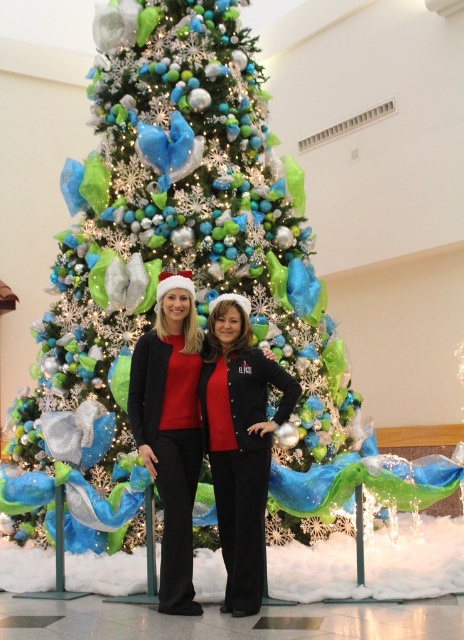
Question: Is shiny metallic christmas tree at center to the left of matte black pants at center from the viewer's perspective?

Choices:
 (A) yes
 (B) no

Answer: (A)

Question: Estimate the real-world distances between objects in this image. Which object is farther from the shiny metallic christmas tree at center?

Choices:
 (A) matte black pants at center
 (B) black matte jacket at center

Answer: (B)

Question: Can you confirm if shiny metallic christmas tree at center is positioned to the right of black matte jacket at center?

Choices:
 (A) yes
 (B) no

Answer: (B)

Question: Which object is the closest to the shiny metallic christmas tree at center?

Choices:
 (A) matte black pants at center
 (B) black matte jacket at center

Answer: (A)

Question: Is shiny metallic christmas tree at center closer to camera compared to matte black pants at center?

Choices:
 (A) yes
 (B) no

Answer: (B)

Question: Which point is farther to the camera?

Choices:
 (A) matte black pants at center
 (B) shiny metallic christmas tree at center
 (C) black matte jacket at center

Answer: (B)